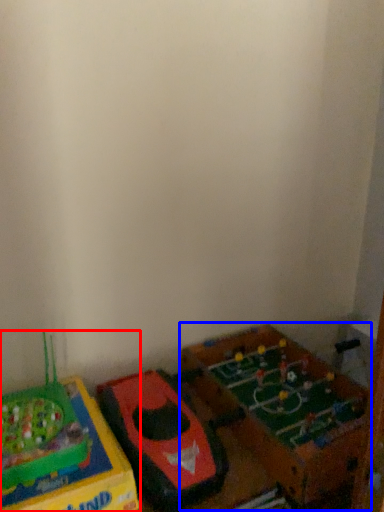
Question: Which point is closer to the camera, toy (highlighted by a red box) or toy (highlighted by a blue box)?

Choices:
 (A) toy
 (B) toy

Answer: (A)